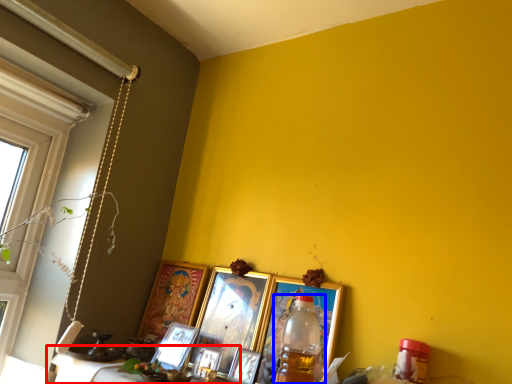
Question: Which object is further to the camera taking this photo, table (highlighted by a red box) or bottle (highlighted by a blue box)?

Choices:
 (A) table
 (B) bottle

Answer: (A)